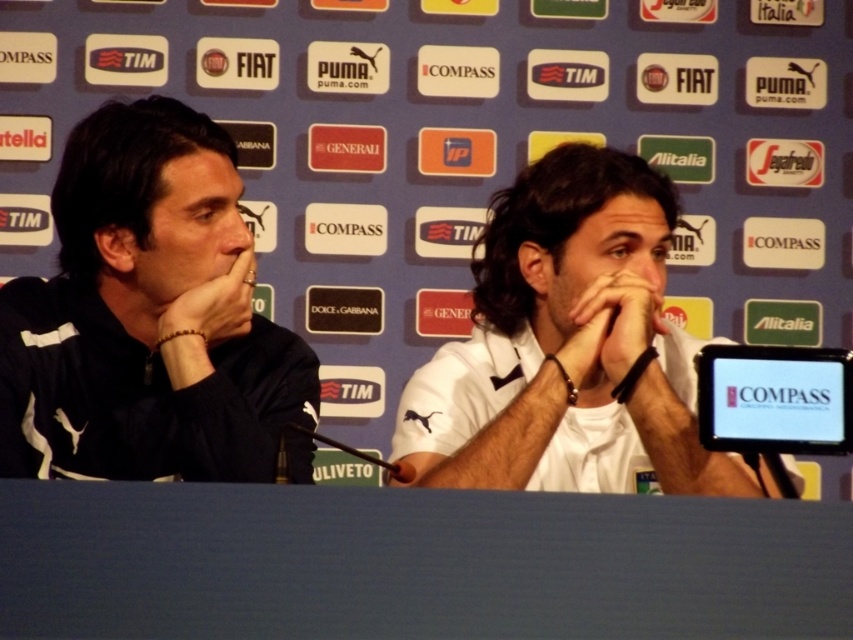
Question: Where is dark blue jersey at left located in relation to white matte shirt at center in the image?

Choices:
 (A) above
 (B) below

Answer: (A)

Question: Does dark blue jersey at left have a smaller size compared to white matte shirt at center?

Choices:
 (A) yes
 (B) no

Answer: (A)

Question: Among these objects, which one is nearest to the camera?

Choices:
 (A) white matte shirt at center
 (B) dark blue jersey at left

Answer: (A)

Question: Can you confirm if dark blue jersey at left is positioned to the right of white matte shirt at center?

Choices:
 (A) no
 (B) yes

Answer: (A)

Question: Which object appears closest to the camera in this image?

Choices:
 (A) dark blue jersey at left
 (B) white matte shirt at center

Answer: (B)